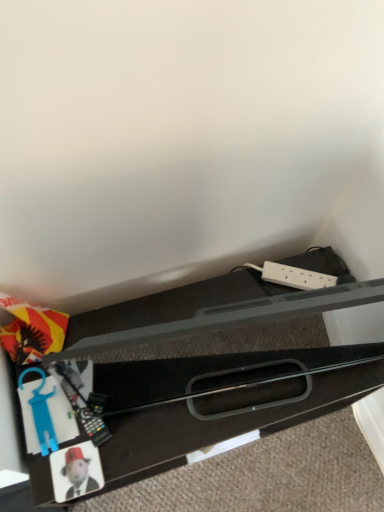
What are the coordinates of `vacant area that lies to the right of matte plastic coaster at lower left, the second toy viewed from the top` in the screenshot? It's located at (147, 442).